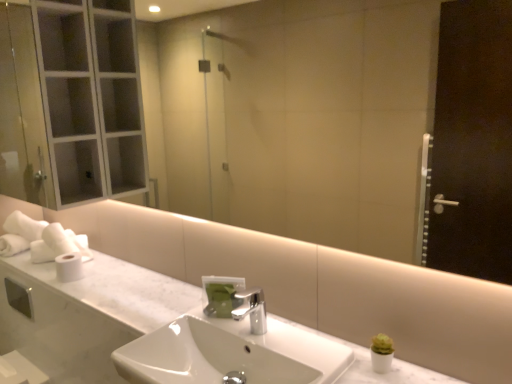
The height and width of the screenshot is (384, 512). Identify the location of vacant area that is in front of polished metallic faucet at center. (274, 349).